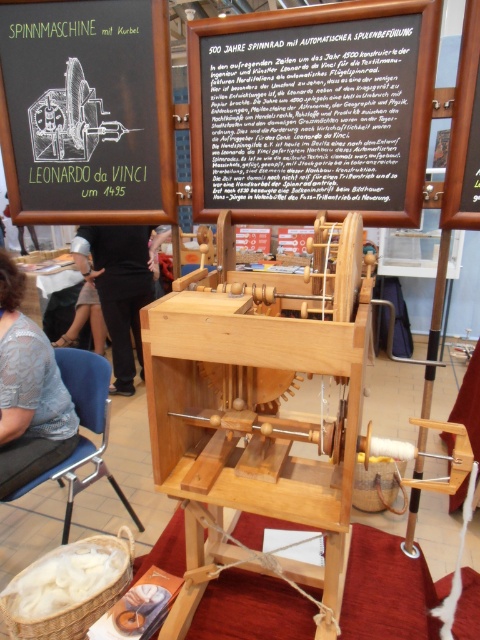
You are an event organizer at the exhibition and need to adjust the layout. You want to place a new decorative element between the wooden signboard at center and the black fabric at center. Is there enough space between them for a 10 cm wide decoration?

The wooden signboard at center is to the right of the black fabric at center, but the exact distance between them is not provided. Without knowing the space between them, it is impossible to determine if a 10 cm wide decoration can fit.

You are an event organizer setting up for a historical exhibition. You have a black fabric at center and a green chalkboard at upper left. Where should you place the black fabric in relation to the green chalkboard to match the scene?

The black fabric at center should be placed under the green chalkboard at upper left as described.